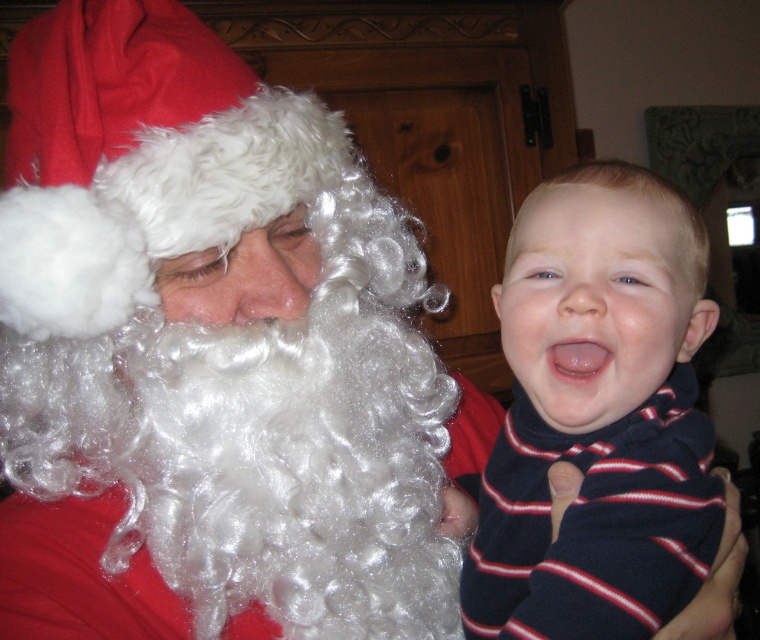
Can you confirm if white curly wig at upper left is thinner than blue striped sweater at center?

Incorrect, white curly wig at upper left's width is not less than blue striped sweater at center's.

Does white curly wig at upper left appear on the right side of blue striped sweater at center?

Incorrect, white curly wig at upper left is not on the right side of blue striped sweater at center.

Identify the location of white curly wig at upper left. (211, 355).

Does point (356, 358) lie behind point (51, 474)?

No, it is not.

Who is higher up, white curly wig at upper left or white curly hair at left?

white curly wig at upper left is above.

Is point (268, 458) closer to viewer compared to point (258, 349)?

No, (268, 458) is behind (258, 349).

At what (x,y) coordinates should I click in order to perform the action: click on white curly wig at upper left. Please return your answer as a coordinate pair (x, y). This screenshot has height=640, width=760. Looking at the image, I should click on (211, 355).

Who is more forward, (8, 344) or (662, 372)?

Point (662, 372)

The image size is (760, 640). I want to click on white curly hair at left, so [255, 461].

Is point (353, 595) farther from camera compared to point (540, 244)?

Yes, point (353, 595) is farther from viewer.

Identify the location of white curly hair at left. [x=255, y=461].